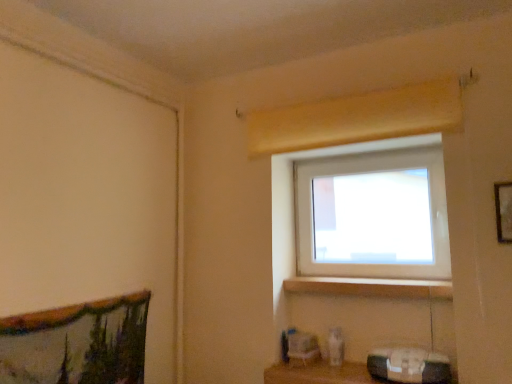
Question: Looking at the image, does wooden shelf at lower center seem bigger or smaller compared to white plastic window at upper center?

Choices:
 (A) big
 (B) small

Answer: (B)

Question: Based on their positions, is wooden shelf at lower center located to the left or right of white plastic window at upper center?

Choices:
 (A) right
 (B) left

Answer: (B)

Question: Which is nearer to the white plastic window at upper center?

Choices:
 (A) wooden at lower center
 (B) wooden shelf at lower center
 (C) wooden picture frame at upper right

Answer: (A)

Question: Which is farther from the wooden shelf at lower center?

Choices:
 (A) wooden at lower center
 (B) white plastic window at upper center
 (C) wooden picture frame at upper right

Answer: (C)